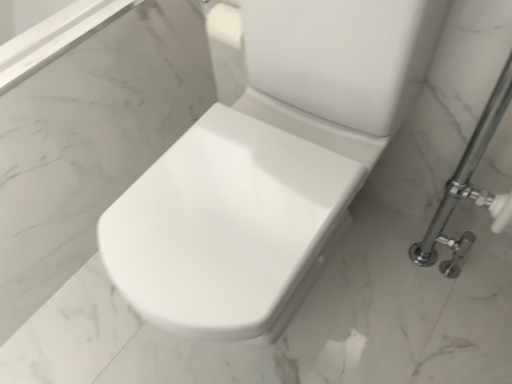
Identify the location of chrome/metallic shower at right. This screenshot has width=512, height=384. [465, 184].

The image size is (512, 384). Describe the element at coordinates (465, 184) in the screenshot. I see `chrome/metallic shower at right` at that location.

Where is `chrome/metallic shower at right`? The height and width of the screenshot is (384, 512). chrome/metallic shower at right is located at coordinates (465, 184).